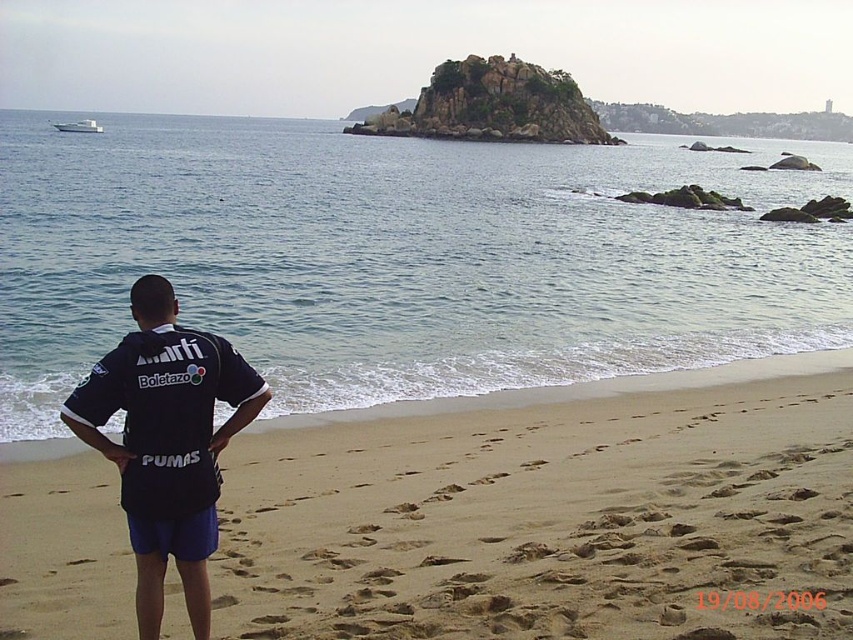
You are planning to take a photo of the beach scene. You want to ensure that both the blue water at center and the white glossy boat at upper left are clearly visible in the frame. Based on their sizes in the image, which object should you prioritize positioning closer to the center of your camera viewfinder to ensure it doesn

The blue water at center is wider than the white glossy boat at upper left. Since it is larger in the image, positioning it closer to the center of the camera viewfinder will help ensure both objects are clearly visible while maintaining balance in the composition.

Looking at this image, you are standing on the beach and want to take a photo of the blue water at center. Where should you point your camera?

You should point your camera towards the center of the image at point coordinates approximately 0.403 on the x axis and 0.471 on the y axis to capture the blue water at center.

You are a photographer trying to capture the entire scene of the blue water at center and the dark blue jersey at center in a single shot. Based on their positions, do you think you can fit both objects in your camera frame without moving your position?

The blue water at center might be wider than dark blue jersey at center, so there is a possibility that both can fit in the frame if the camera has a wide enough angle. However, without knowing the exact dimensions or distance between them, it is uncertain.